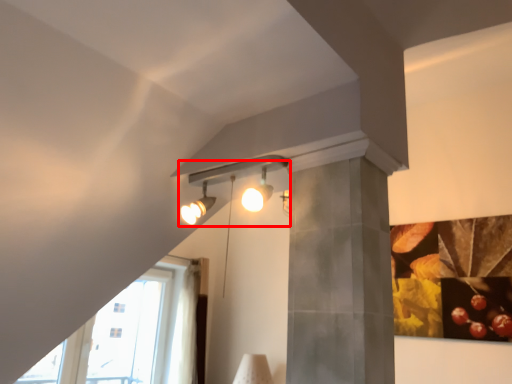
Question: From the image's perspective, what is the correct spatial relationship of lamp (annotated by the red box) in relation to glass door?

Choices:
 (A) above
 (B) below

Answer: (A)